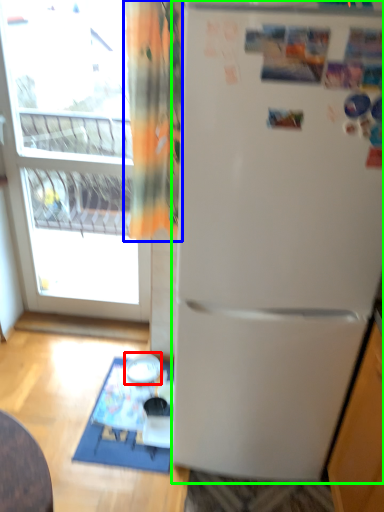
Question: Estimate the real-world distances between objects in this image. Which object is farther from appliance (highlighted by a red box), curtain (highlighted by a blue box) or refrigerator (highlighted by a green box)?

Choices:
 (A) curtain
 (B) refrigerator

Answer: (A)